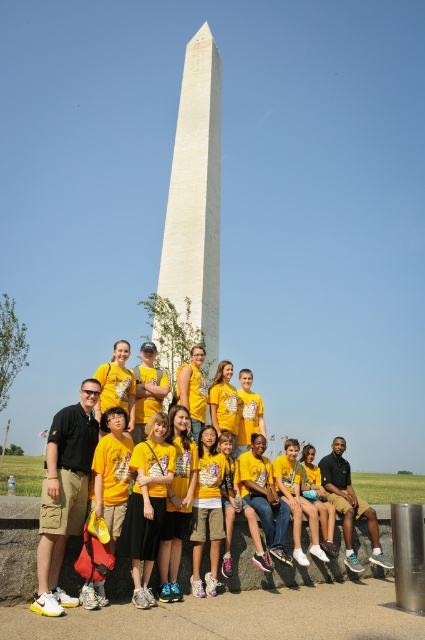
Question: Observing the image, what is the correct spatial positioning of yellow cotton shirt at center in reference to white marble obelisk at center?

Choices:
 (A) left
 (B) right

Answer: (A)

Question: Can you confirm if yellow cotton shirt at center is positioned to the right of white marble obelisk at center?

Choices:
 (A) yes
 (B) no

Answer: (B)

Question: Is yellow cotton shirt at center behind white marble obelisk at center?

Choices:
 (A) no
 (B) yes

Answer: (A)

Question: Which object appears closest to the camera in this image?

Choices:
 (A) yellow cotton shirt at center
 (B) white marble obelisk at center

Answer: (A)

Question: Which point is farther to the camera?

Choices:
 (A) tap(221, 61)
 (B) tap(159, 524)

Answer: (A)